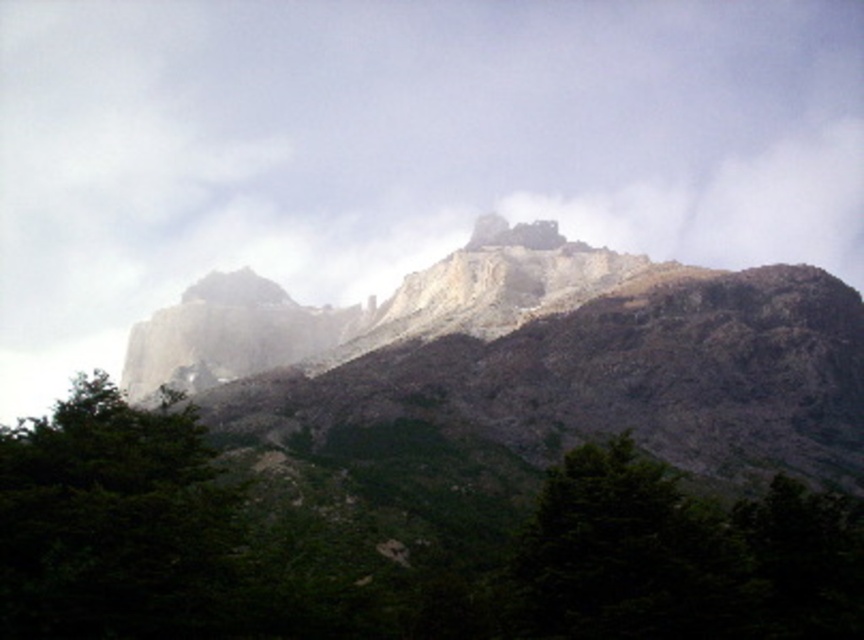
Between point (147, 236) and point (529, 612), which one is positioned behind?

Point (147, 236)

Is white foggy cloud at upper center below green matte tree at lower center?

Actually, white foggy cloud at upper center is above green matte tree at lower center.

Does point (363, 29) come in front of point (615, 598)?

No.

What are the coordinates of `white foggy cloud at upper center` in the screenshot? It's located at (410, 140).

Can you confirm if green matte tree at lower center is positioned to the left of rugged stone castle at upper center?

Yes, green matte tree at lower center is to the left of rugged stone castle at upper center.

Find the location of `green matte tree at lower center`. green matte tree at lower center is located at coordinates (614, 552).

Image resolution: width=864 pixels, height=640 pixels. What are the coordinates of `green matte tree at lower center` in the screenshot? It's located at (614, 552).

Which of these two, white foggy cloud at upper center or green leafy tree at lower left, stands taller?

white foggy cloud at upper center

This screenshot has width=864, height=640. I want to click on white foggy cloud at upper center, so click(410, 140).

This screenshot has width=864, height=640. Identify the location of white foggy cloud at upper center. (410, 140).